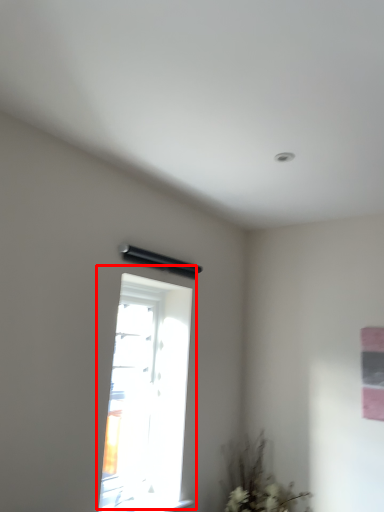
Question: Where is window (annotated by the red box) located in relation to plant in the image?

Choices:
 (A) left
 (B) right

Answer: (A)